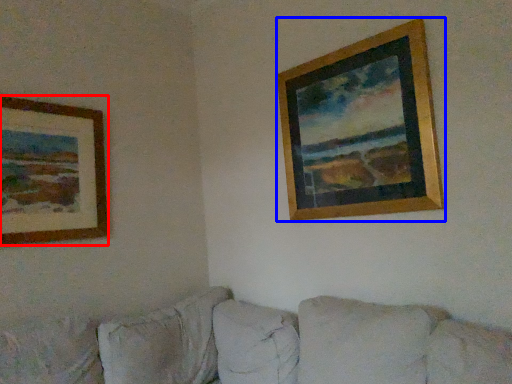
Question: Which point is further to the camera, picture frame (highlighted by a red box) or picture frame (highlighted by a blue box)?

Choices:
 (A) picture frame
 (B) picture frame

Answer: (A)